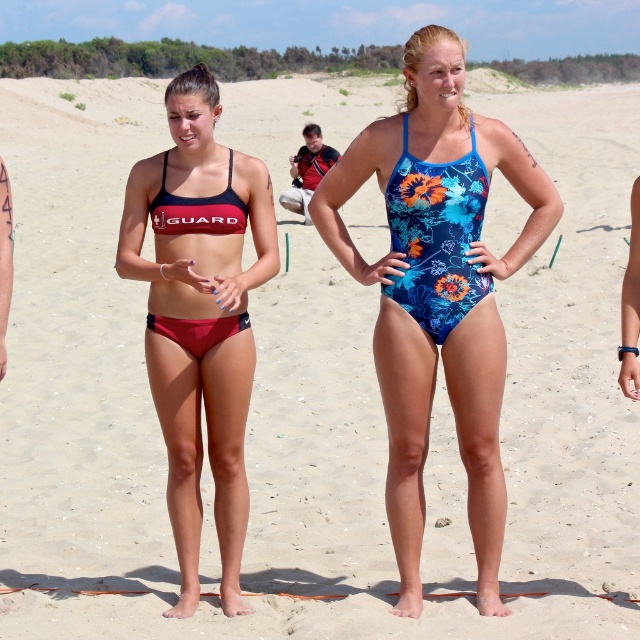
You are taking a photo of the two people at the beach. The first person is at point (419,115) and the second is at point (404,276). Which point is closer to the camera?

Point (419,115) is further to the camera than point (404,276), so the second point is closer to the camera.